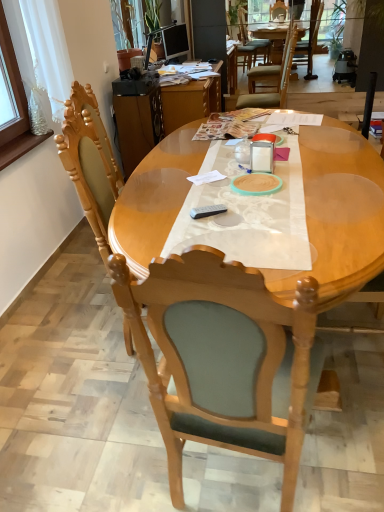
Question: Can wooden chair at center, which is counted as the first chair, starting from the front, be found inside wooden desk at center?

Choices:
 (A) no
 (B) yes

Answer: (A)

Question: From the image's perspective, is wooden desk at center located beneath wooden chair at center, placed as the 2th chair when sorted from back to front?

Choices:
 (A) no
 (B) yes

Answer: (A)

Question: Considering the relative positions of wooden desk at center and wooden chair at center, which is the 2th chair in top-to-bottom order, in the image provided, is wooden desk at center to the right of wooden chair at center, which is the 2th chair in top-to-bottom order, from the viewer's perspective?

Choices:
 (A) no
 (B) yes

Answer: (A)

Question: From a real-world perspective, does wooden desk at center sit lower than wooden chair at center, placed as the 2th chair when sorted from back to front?

Choices:
 (A) yes
 (B) no

Answer: (A)

Question: Considering the relative sizes of wooden desk at center and wooden chair at center, marked as the second chair in a right-to-left arrangement, in the image provided, is wooden desk at center shorter than wooden chair at center, marked as the second chair in a right-to-left arrangement,?

Choices:
 (A) no
 (B) yes

Answer: (B)

Question: Is green fabric chair at upper center, which is the 2th chair from left to right, wider or thinner than wooden chair at center, marked as the second chair in a right-to-left arrangement?

Choices:
 (A) thin
 (B) wide

Answer: (B)

Question: In the image, is green fabric chair at upper center, arranged as the first chair when viewed from the top, positioned in front of or behind wooden chair at center, placed as the 2th chair when sorted from back to front?

Choices:
 (A) front
 (B) behind

Answer: (B)

Question: Would you say green fabric chair at upper center, arranged as the first chair when viewed from the top, is to the left or to the right of wooden chair at center, which appears as the first chair when viewed from the left, in the picture?

Choices:
 (A) left
 (B) right

Answer: (B)

Question: Considering the positions of green fabric chair at upper center, positioned as the 1th chair in back-to-front order, and wooden chair at center, which appears as the first chair when viewed from the left, in the image, is green fabric chair at upper center, positioned as the 1th chair in back-to-front order, taller or shorter than wooden chair at center, which appears as the first chair when viewed from the left,?

Choices:
 (A) tall
 (B) short

Answer: (B)

Question: Considering the positions of green fabric chair at upper center, positioned as the 1th chair in back-to-front order, and wooden desk at center in the image, is green fabric chair at upper center, positioned as the 1th chair in back-to-front order, wider or thinner than wooden desk at center?

Choices:
 (A) thin
 (B) wide

Answer: (A)

Question: From the image's perspective, relative to wooden desk at center, is green fabric chair at upper center, positioned as the 1th chair in back-to-front order, above or below?

Choices:
 (A) above
 (B) below

Answer: (A)

Question: From a real-world perspective, is green fabric chair at upper center, the 2th chair when ordered from front to back, physically located above or below wooden desk at center?

Choices:
 (A) above
 (B) below

Answer: (A)

Question: Is green fabric chair at upper center, the 2th chair when ordered from front to back, in front of or behind wooden desk at center in the image?

Choices:
 (A) behind
 (B) front

Answer: (A)

Question: From a real-world perspective, is green fabric chair at upper center, arranged as the first chair when viewed from the top, above or below light wood table at center?

Choices:
 (A) above
 (B) below

Answer: (A)

Question: In the image, is green fabric chair at upper center, which ranks as the first chair in right-to-left order, on the left side or the right side of light wood table at center?

Choices:
 (A) left
 (B) right

Answer: (B)